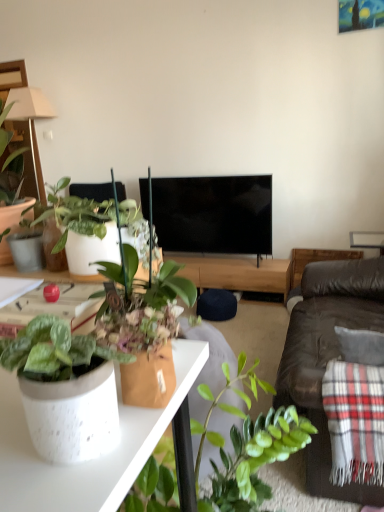
Question: Considering the positions of beige fabric lamp at upper left and speckled ceramic pot at lower left, arranged as the second houseplant when viewed from the top, in the image, is beige fabric lamp at upper left bigger or smaller than speckled ceramic pot at lower left, arranged as the second houseplant when viewed from the top,?

Choices:
 (A) big
 (B) small

Answer: (A)

Question: Is beige fabric lamp at upper left inside the boundaries of speckled ceramic pot at lower left, the second houseplant in the left-to-right sequence, or outside?

Choices:
 (A) inside
 (B) outside

Answer: (B)

Question: Based on their relative distances, which object is farther from the brown leather couch at right?

Choices:
 (A) white speckled pot at left, acting as the first houseplant starting from the top
 (B) white speckled ceramic pot at lower left
 (C) black glossy tv at center
 (D) speckled ceramic pot at lower left, arranged as the first houseplant when viewed from the right
 (E) plaid woolen blanket at right

Answer: (A)

Question: Estimate the real-world distances between objects in this image. Which object is farther from the beige fabric lamp at upper left?

Choices:
 (A) black glossy tv at center
 (B) white speckled pot at left, which appears as the 1th houseplant when viewed from the back
 (C) plaid woolen blanket at right
 (D) speckled ceramic pot at lower left, the second houseplant in the left-to-right sequence
 (E) brown leather couch at right

Answer: (C)